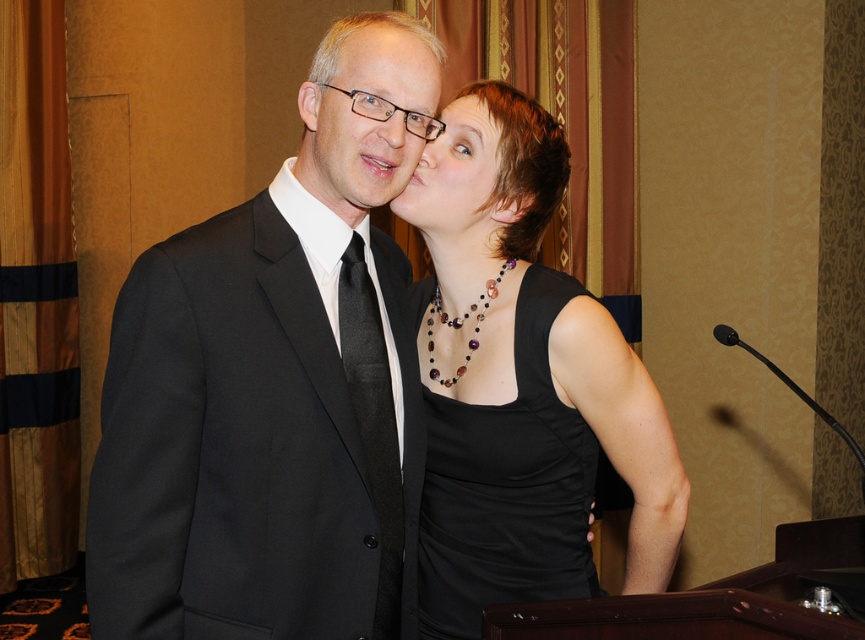
Question: Which of the following is the closest to the observer?

Choices:
 (A) (463, 609)
 (B) (338, 100)

Answer: (B)

Question: Does matte black suit at center have a lesser width compared to black textured tie at left?

Choices:
 (A) no
 (B) yes

Answer: (A)

Question: Can you confirm if black matte suit at center is positioned below matte black dress at center?

Choices:
 (A) yes
 (B) no

Answer: (A)

Question: Among these objects, which one is farthest from the camera?

Choices:
 (A) black textured tie at left
 (B) matte black suit at center

Answer: (A)

Question: Which object is the closest to the matte black dress at center?

Choices:
 (A) black matte tank top at center
 (B) black matte dress at center
 (C) black textured tie at left
 (D) black matte suit at center

Answer: (A)

Question: Is black matte tank top at center smaller than matte black suit at center?

Choices:
 (A) yes
 (B) no

Answer: (B)